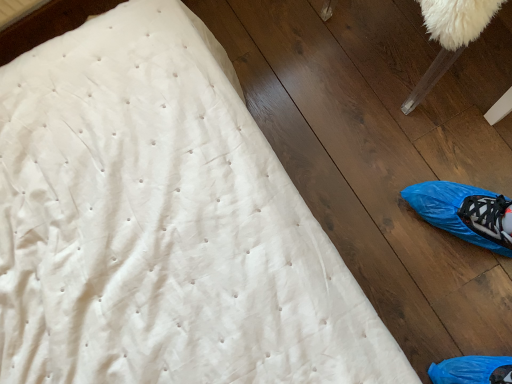
Identify the location of vacant space situated on the left part of white fluffy bean bag chair at upper right. (308, 101).